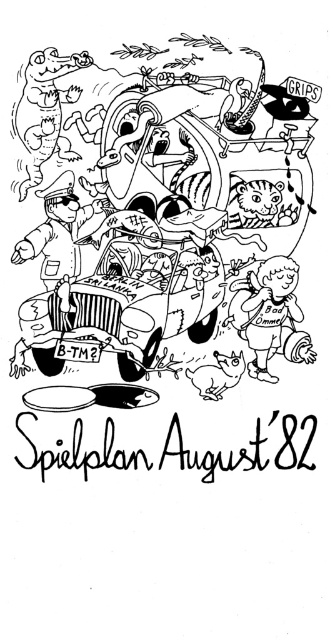
Between point (177, 266) and point (99, 262), which one is positioned behind?

Point (99, 262)

Find the location of a particular element. The height and width of the screenshot is (640, 335). black rubber car at center is located at coordinates (165, 211).

The height and width of the screenshot is (640, 335). What are the coordinates of `black rubber car at center` in the screenshot? It's located at (165, 211).